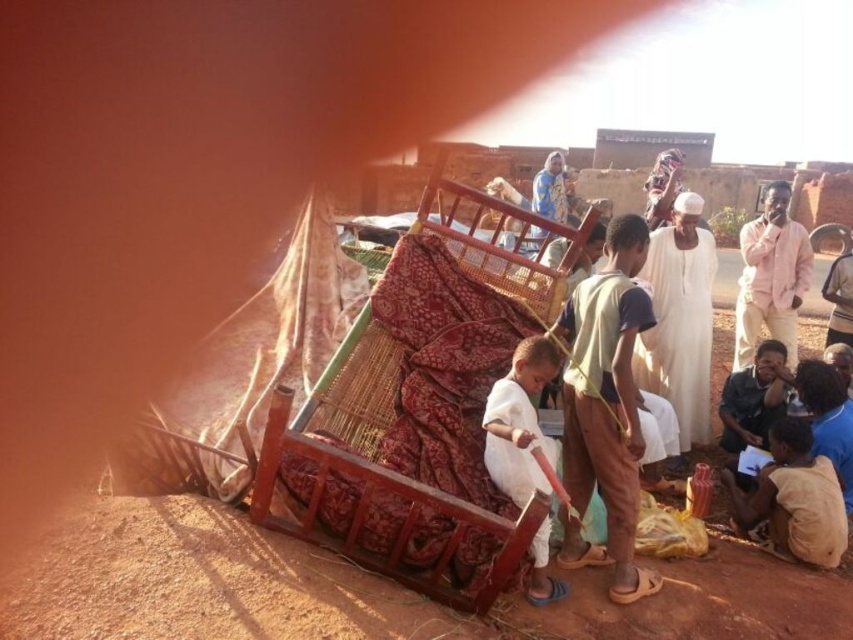
Measure the distance between point (517, 492) and camera.

They are 3.50 meters apart.

Can you confirm if white cotton child at center is wider than pink cotton shirt at upper right?

No.

This screenshot has width=853, height=640. In order to click on white cotton child at center in this screenshot , I will do `click(520, 422)`.

Can you confirm if brown dirt field at lower center is positioned above pink cotton shirt at upper right?

No, brown dirt field at lower center is not above pink cotton shirt at upper right.

In the scene shown: Who is taller, brown dirt field at lower center or pink cotton shirt at upper right?

With more height is pink cotton shirt at upper right.

Is point (769, 582) positioned in front of point (749, 342)?

Yes, point (769, 582) is in front of point (749, 342).

This screenshot has width=853, height=640. What are the coordinates of `brown dirt field at lower center` in the screenshot? It's located at (364, 589).

Which is more to the right, brown dirt field at lower center or white cotton child at center?

white cotton child at center

Can you confirm if brown dirt field at lower center is positioned to the left of white cotton child at center?

Correct, you'll find brown dirt field at lower center to the left of white cotton child at center.

Does point (86, 616) come in front of point (497, 392)?

Yes, it is in front of point (497, 392).

Identify the location of brown dirt field at lower center. This screenshot has height=640, width=853. (364, 589).